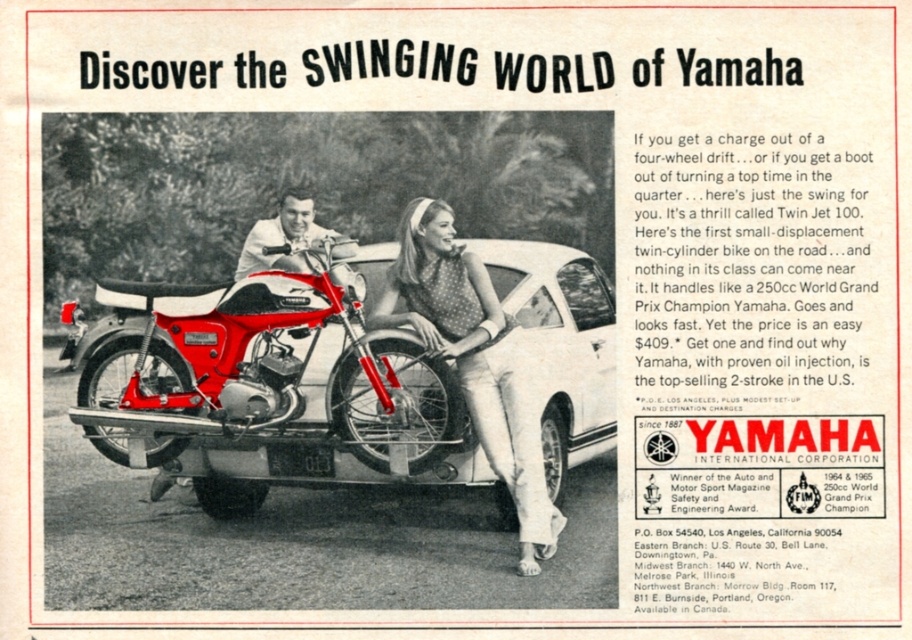
Question: Which of the following is the farthest from the observer?

Choices:
 (A) (289, 262)
 (B) (492, 381)

Answer: (A)

Question: Is white matte car at center above shiny chrome handlebars at center?

Choices:
 (A) yes
 (B) no

Answer: (B)

Question: Does white matte car at center have a lesser width compared to shiny chrome handlebars at center?

Choices:
 (A) yes
 (B) no

Answer: (B)

Question: Based on their relative distances, which object is farther from the shiny chrome handlebars at center?

Choices:
 (A) white matte car at center
 (B) dotted fabric dress at center

Answer: (A)

Question: Which point is farther to the camera?

Choices:
 (A) (249, 248)
 (B) (537, 442)

Answer: (A)

Question: Is white matte car at center positioned behind dotted fabric dress at center?

Choices:
 (A) no
 (B) yes

Answer: (B)